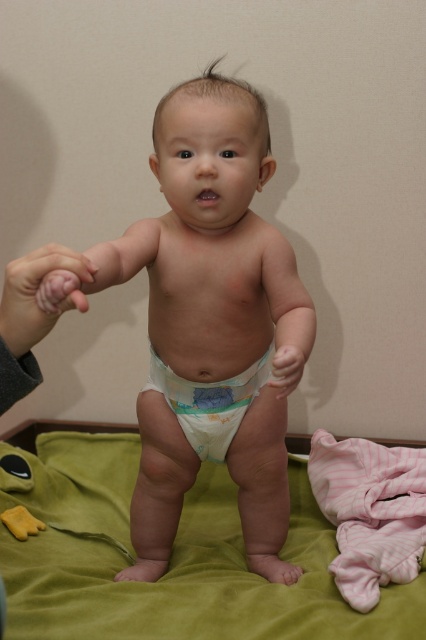
You are a photographer setting up for a baby photoshoot. The baby is wearing a white disposable diaper at center and there is a yellow rubber duck at lower left on the green blanket. You need to ensure the diaper is visible in the shot. Should you adjust the camera angle to focus more on the diaper compared to the duck?

The white disposable diaper at center might be wider than yellow rubber duck at lower left, so focusing on the diaper could ensure it remains visible as it occupies more space in the frame.

You are a photographer setting up for a baby photoshoot. You need to place a prop between the white disposable diaper at center and the yellow rubber duck at lower left. Where should you place the prop so it is between them?

The white disposable diaper at center is positioned on the right side of the yellow rubber duck at lower left, so placing the prop between them would require positioning it to the left of the white disposable diaper at center and to the right of the yellow rubber duck at lower left.

You are a parent trying to place the baby on either the green velvety bed at center or the pink soft skin at left. Based on their sizes, which surface would you choose to ensure the baby has enough space to move comfortably?

The green velvety bed at center is wider than the pink soft skin at left, so you should choose the green velvety bed at center to give the baby enough space to move comfortably.